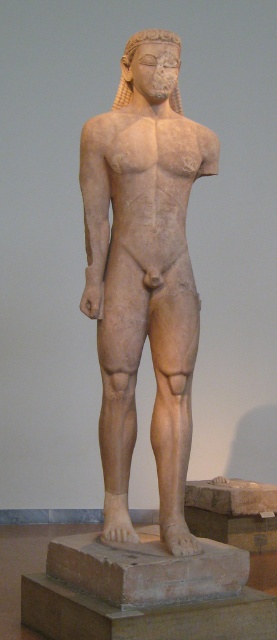
You are an art conservator examining the statue from the front. You notice two points marked on the statue, one at coordinates point (x=121, y=136) and another at point (x=237, y=557). Which point is closer to the viewer when looking at the statue from the front?

Point (x=237, y=557) is closer to the viewer than point (x=121, y=136) when looking at the statue from the front.

You are an art conservator assessing the stability of the beige stone statue at center and the beige stone base at center. Given that the statue is placed on the base, can you determine if the statue is taller than the base?

The beige stone statue at center is taller than the beige stone base at center, so yes, the statue is taller than the base.